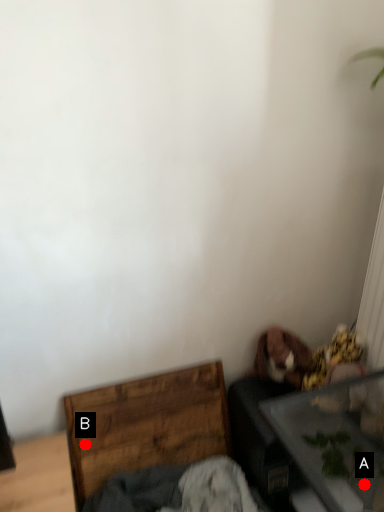
Question: Two points are circled on the image, labeled by A and B beside each circle. Which point is farther to the camera?

Choices:
 (A) A is further
 (B) B is further

Answer: (A)